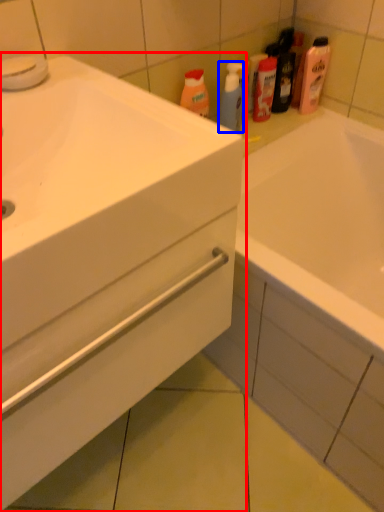
Question: Among these objects, which one is farthest to the camera, bathroom cabinet (highlighted by a red box) or cleaning product (highlighted by a blue box)?

Choices:
 (A) bathroom cabinet
 (B) cleaning product

Answer: (B)